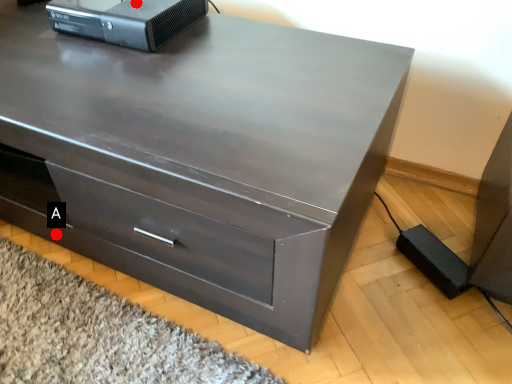
Question: Two points are circled on the image, labeled by A and B beside each circle. Which point is farther from the camera taking this photo?

Choices:
 (A) A is further
 (B) B is further

Answer: (A)